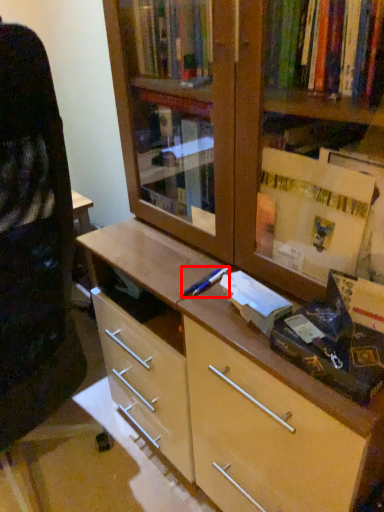
Question: Where is pen (annotated by the red box) located in relation to book in the image?

Choices:
 (A) left
 (B) right

Answer: (A)